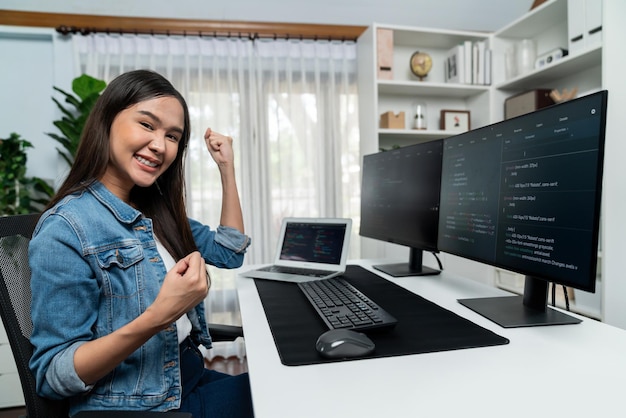
Where is `bookcase`? bookcase is located at coordinates (444, 96), (578, 77).